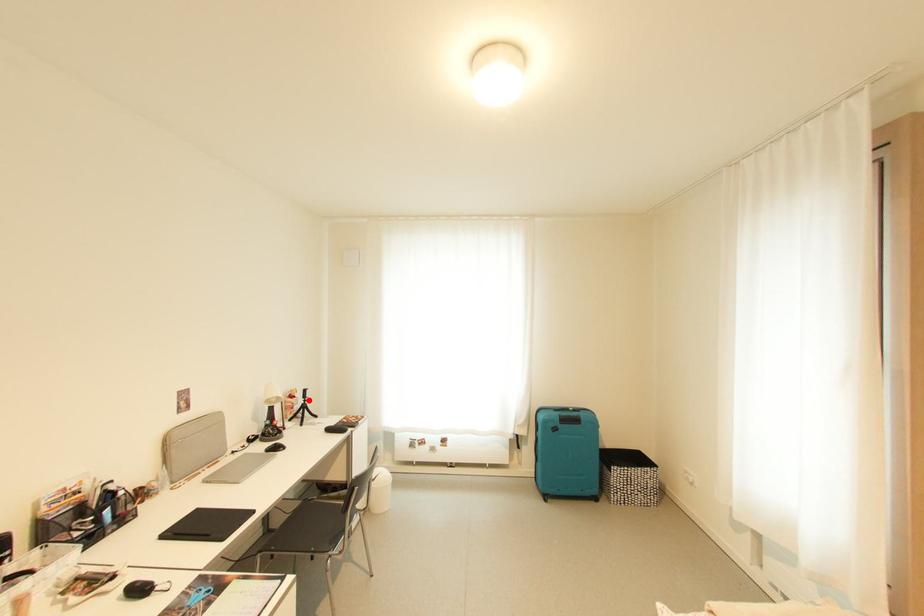
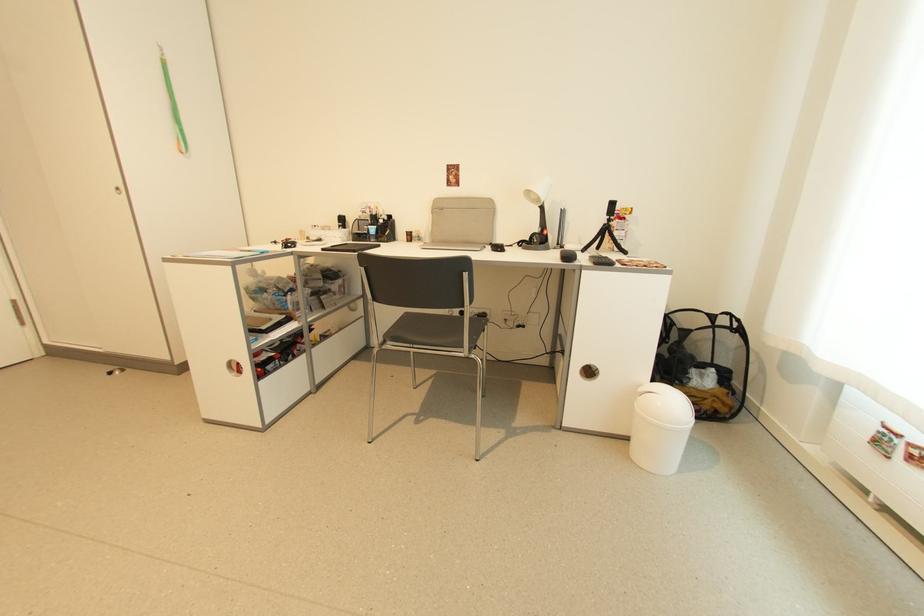
Question: I am providing you with two images of the same scene from different viewpoints. A red point is shown in image1. For the corresponding object point in image2, is it positioned nearer or farther from the camera?

Choices:
 (A) Nearer
 (B) Farther

Answer: (A)